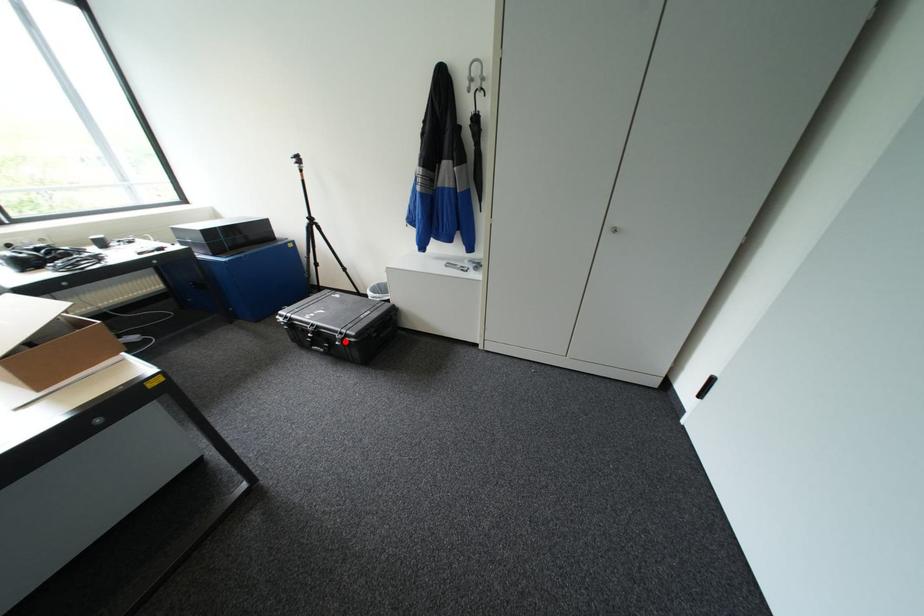
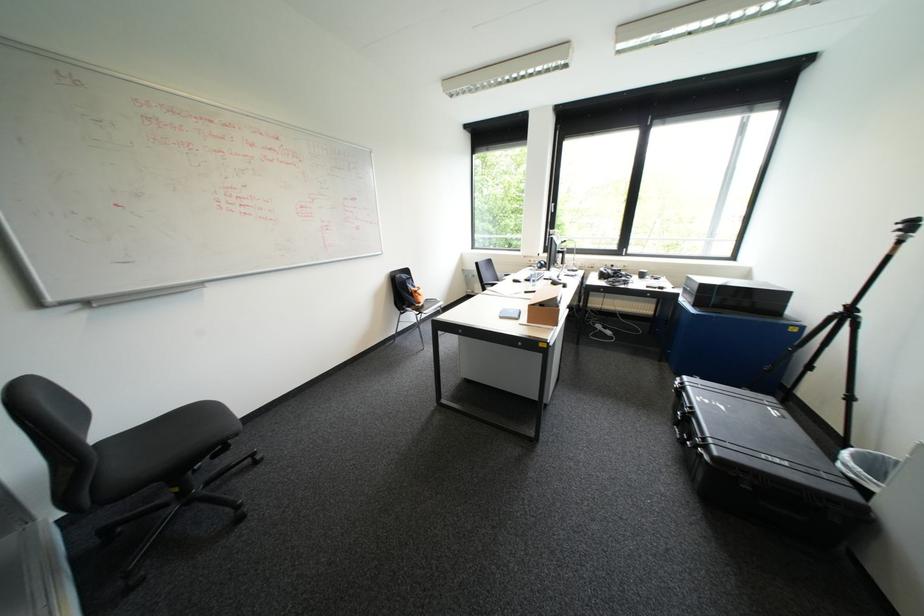
Locate, in the second image, the point that corresponds to the highlighted location in the first image.

(697, 440)